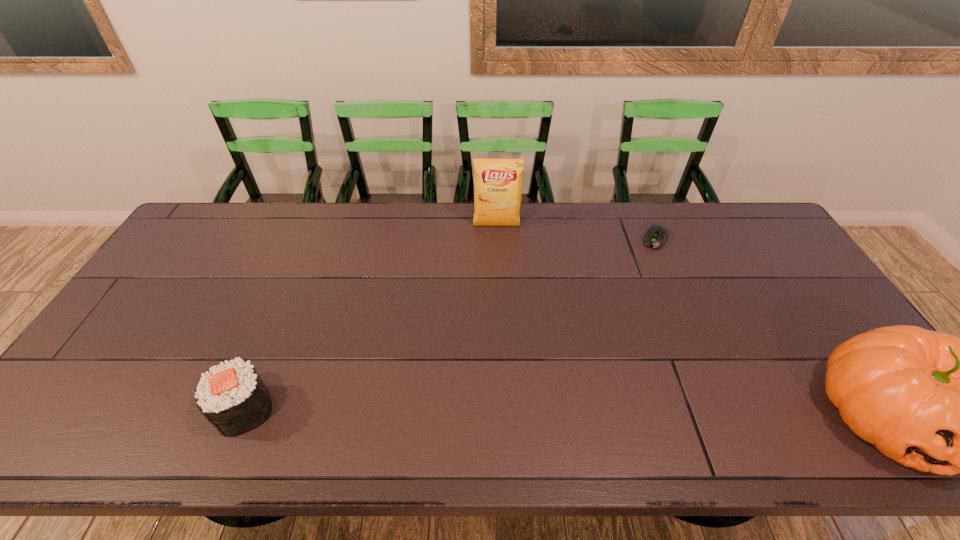
Where is `the second shortest object`? the second shortest object is located at coordinates (233, 398).

The image size is (960, 540). I want to click on the leftmost object, so click(233, 398).

You are a GUI agent. You are given a task and a screenshot of the screen. Output one action in this format:
    pyautogui.click(x=<x>, y=<y>)
    Task: Click on the second object from left to right
    This screenshot has width=960, height=540.
    Given the screenshot: What is the action you would take?
    pyautogui.click(x=498, y=181)

Where is `the shortest object`? The image size is (960, 540). the shortest object is located at coordinates (655, 237).

Locate an element on the screen. computer mouse is located at coordinates (655, 237).

This screenshot has width=960, height=540. I want to click on blank area located on the right of the third tallest object, so click(354, 410).

Identify the location of vacant space located 0.100m on the front of the second object from left to right with the logo. Image resolution: width=960 pixels, height=540 pixels. (497, 251).

I want to click on vacant area situated on the front of the second object from left to right with the logo, so click(x=497, y=248).

The width and height of the screenshot is (960, 540). What are the coordinates of `vacant area situated on the front of the second object from left to right with the logo` in the screenshot? It's located at (497, 246).

Find the location of a particular element. The height and width of the screenshot is (540, 960). vacant space located 0.340m on the wheel side of the shortest object is located at coordinates (623, 319).